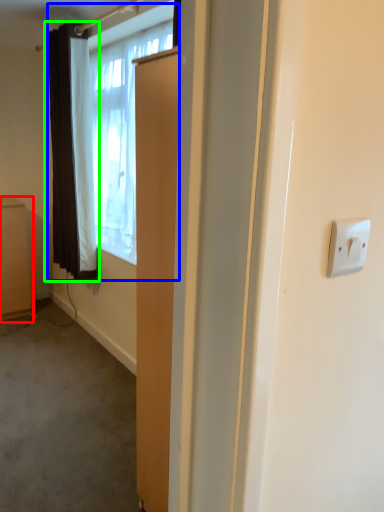
Question: Considering the real-world distances, which object is farthest from cabinetry (highlighted by a red box)? window (highlighted by a blue box) or curtain (highlighted by a green box)?

Choices:
 (A) window
 (B) curtain

Answer: (A)